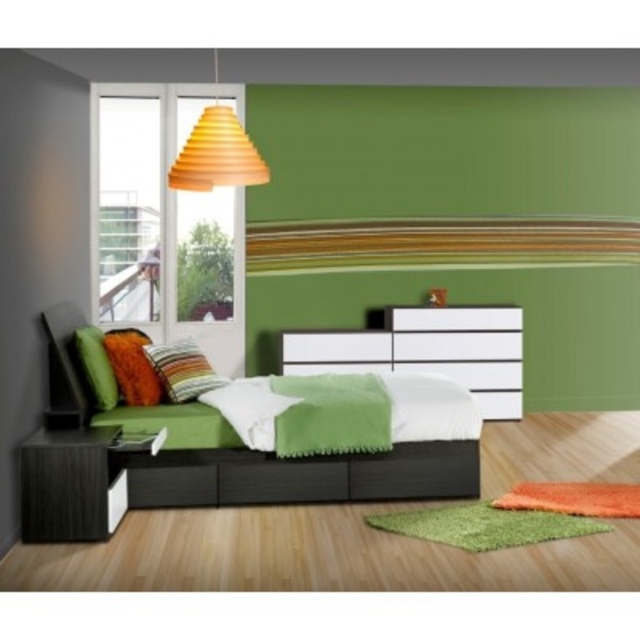
You are an interior designer arranging a modern bedroom. You have an orange matte cone at upper center and a velvet orange pillow at center. Which object is located to the right of the other?

The orange matte cone at upper center is positioned on the right side of velvet orange pillow at center.

In the scene shown: You are standing in the bedroom and want to place a new lamp between the matte black bed at center and the white glossy dresser at center. Based on their positions, which side of the dresser should the lamp be placed on?

The matte black bed at center is to the left of the white glossy dresser at center, so the lamp should be placed on the left side of the dresser to position it between the two objects.

You are a delivery person who just arrived at the house. You need to place a new 1.8 meter wide sofa in the bedroom. The sofa is currently at the front door, which is located opposite the window. You want to position the sofa between the matte black bed at center and the white glossy dresser at center. Is there enough space between the two objects to fit the sofa?

The distance between the matte black bed at center and the white glossy dresser at center is 1.92 meters. Since the sofa is 1.8 meters wide, there is enough space to fit it between them as the distance is slightly larger than the sofa width.